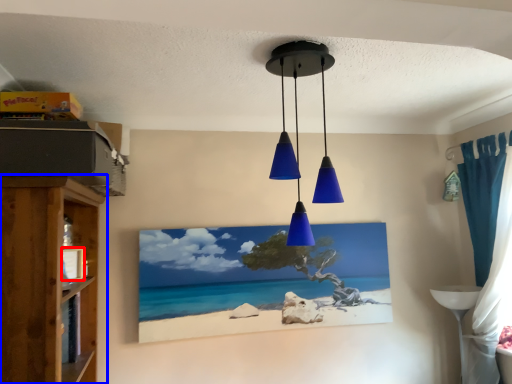
Question: Among these objects, which one is farthest to the camera, picture frame (highlighted by a red box) or shelf (highlighted by a blue box)?

Choices:
 (A) picture frame
 (B) shelf

Answer: (A)